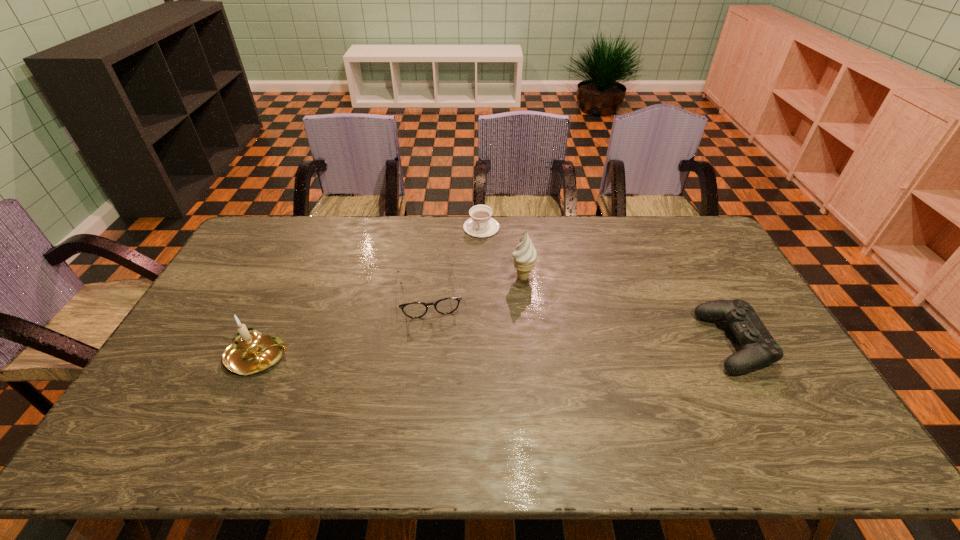
At what (x,y) coordinates should I click in order to perform the action: click on object that is at the right edge. Please return your answer as a coordinate pair (x, y). The image size is (960, 540). Looking at the image, I should click on (759, 349).

At what (x,y) coordinates should I click in order to perform the action: click on blank space at the far edge of the desktop. Please return your answer as a coordinate pair (x, y). Looking at the image, I should click on (558, 233).

Where is `vacant area at the near edge of the desktop`? vacant area at the near edge of the desktop is located at coordinates (272, 416).

At what (x,y) coordinates should I click in order to perform the action: click on free spot at the left edge of the desktop. Please return your answer as a coordinate pair (x, y). The width and height of the screenshot is (960, 540). Looking at the image, I should click on (235, 260).

In the image, there is a desktop. At what (x,y) coordinates should I click in order to perform the action: click on vacant space at the right edge. Please return your answer as a coordinate pair (x, y). This screenshot has width=960, height=540. Looking at the image, I should click on (735, 286).

You are a GUI agent. You are given a task and a screenshot of the screen. Output one action in this format:
    pyautogui.click(x=<x>, y=<y>)
    Task: Click on the free space at the far left corner
    Image resolution: width=960 pixels, height=540 pixels.
    Given the screenshot: What is the action you would take?
    pyautogui.click(x=296, y=215)

Where is `vacant space at the near right corner of the desktop`? Image resolution: width=960 pixels, height=540 pixels. vacant space at the near right corner of the desktop is located at coordinates (785, 417).

The image size is (960, 540). In order to click on unoccupied position between the third tallest object and the teacup in this screenshot , I will do `click(608, 285)`.

At what (x,y) coordinates should I click in order to perform the action: click on empty location between the icecream and the teacup. Please return your answer as a coordinate pair (x, y). Looking at the image, I should click on (502, 252).

Where is `vacant area that lies between the candle holder and the second object from right to left`? vacant area that lies between the candle holder and the second object from right to left is located at coordinates (392, 317).